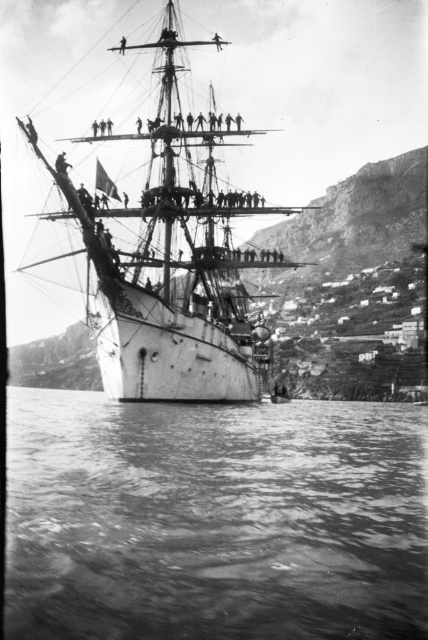
You are a sailor on the white matte ship at center, and you want to check the water conditions ahead. From your position on the ship, which direction should you look to see the smooth water at lower center?

The smooth water at lower center is in front of the white matte ship at center, so you should look forward from your position on the ship to see the smooth water at lower center.

You are a photographer planning to capture the white matte ship at center from the rocky coastline. Since the smooth water at lower center reflects the ship, how does the reflection of the ship compare in width to the actual ship?

The smooth water at lower center reflects the white matte ship at center, and since the smooth water at lower center is wider than the white matte ship at center, the reflection of the ship would be wider than the actual ship.

You are a photographer planning to capture the white matte ship at center and the smooth water at lower center in a single shot. Given their sizes, which one will occupy more of the frame?

The white matte ship at center occupies more of the frame because it is larger than the smooth water at lower center.